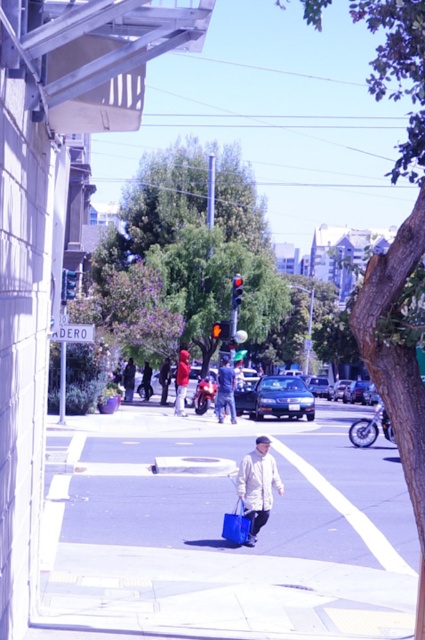
Is shiny blue sedan at center taller than red fabric jacket at center?

No, shiny blue sedan at center is not taller than red fabric jacket at center.

Is shiny blue sedan at center to the right of red fabric jacket at center from the viewer's perspective?

Correct, you'll find shiny blue sedan at center to the right of red fabric jacket at center.

I want to click on shiny blue sedan at center, so click(275, 397).

Locate an element on the screen. shiny blue sedan at center is located at coordinates (275, 397).

Who is more distant from viewer, (282, 486) or (176, 365)?

Point (176, 365)

Who is higher up, white matte coat at center or red fabric jacket at center?

red fabric jacket at center is higher up.

Find the location of a particular element. Image resolution: width=425 pixels, height=640 pixels. white matte coat at center is located at coordinates (257, 484).

Does smooth concrete sidewalk at center have a greater width compared to red fabric jacket at center?

Yes.

Find the location of a particular element. Image resolution: width=425 pixels, height=640 pixels. smooth concrete sidewalk at center is located at coordinates (220, 531).